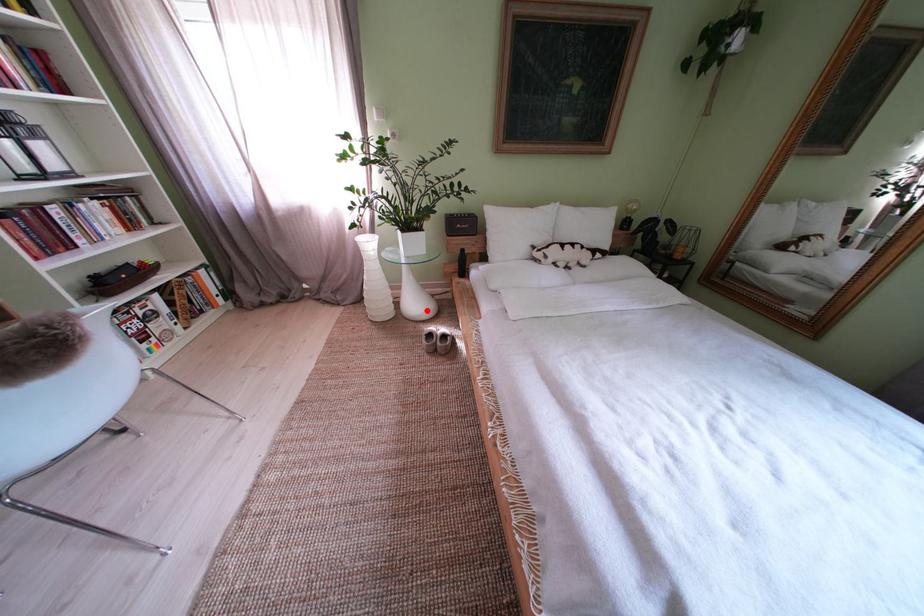
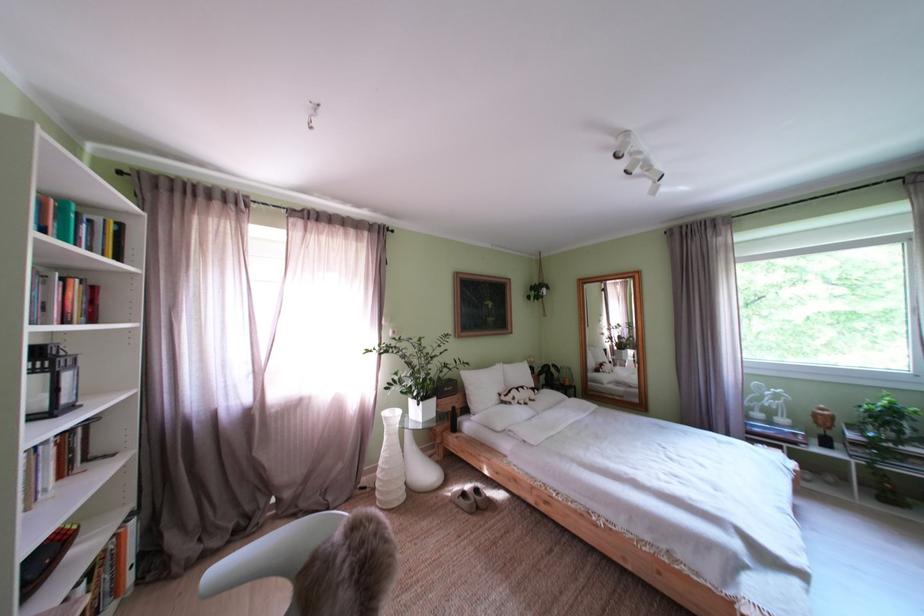
Question: I am providing you with two images of the same scene from different viewpoints. In image1, a red point is highlighted. Considering the same 3D point in image2, which of the following is correct?

Choices:
 (A) It is closer
 (B) It is farther

Answer: (B)